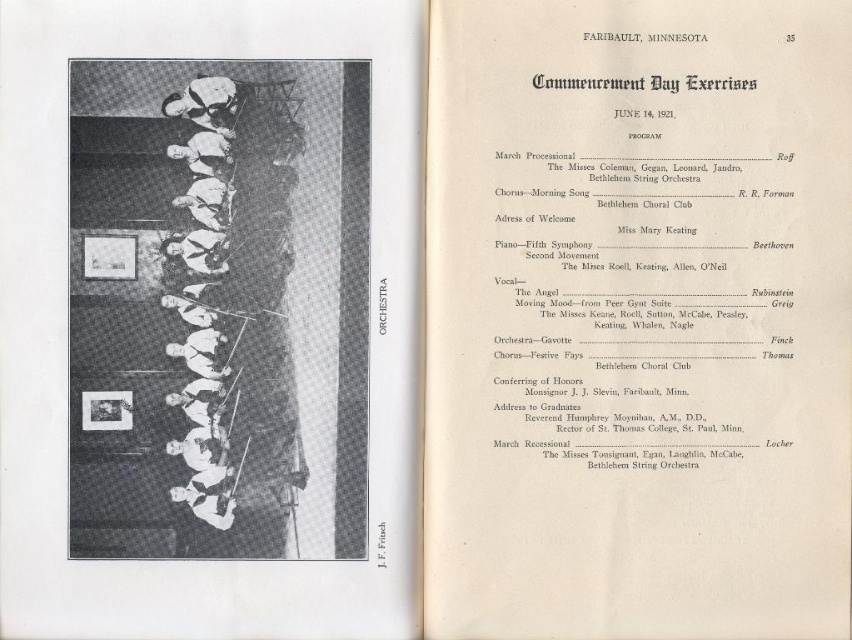
You are organizing a historical exhibit and need to determine the relative sizes of items in this image. Given the white paper menu at upper center and the white matte orchestra at center, which object is bigger?

The white paper menu at upper center is larger in size compared to the white matte orchestra at center.